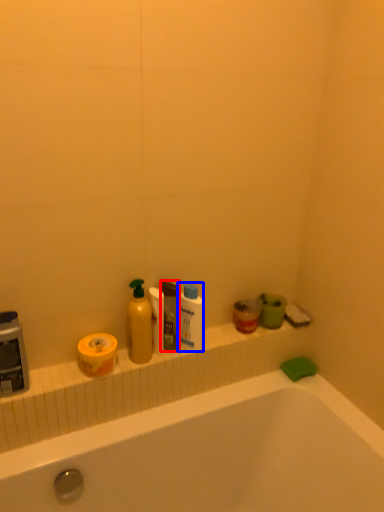
Question: Which of the following is the closest to the observer, mouthwash (highlighted by a red box) or cleaning product (highlighted by a blue box)?

Choices:
 (A) mouthwash
 (B) cleaning product

Answer: (A)